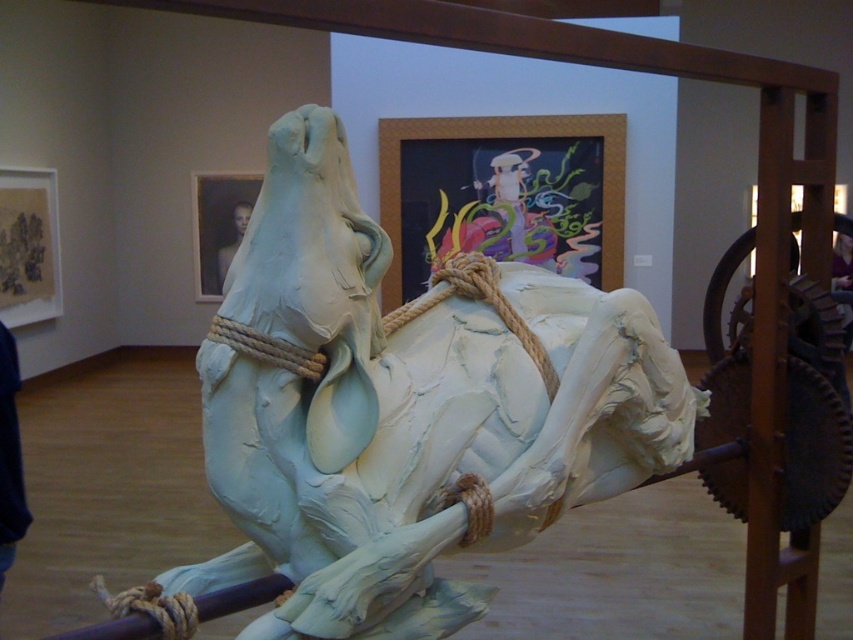
You are an art critic standing in front of the sculpture. You notice the white clay horse at center and the roperoughrope at center. Which object appears nearer to you?

The white clay horse at center is closer to the viewer than the roperoughrope at center, so the white clay horse at center appears nearer.

You are an art critic observing the sculpture of the horse in the gallery. You notice the roperoughrope at center and the smooth skin man at upper center. Which object is positioned higher in the image?

The smooth skin man at upper center is positioned higher than the roperoughrope at center.

You are standing in the gallery and want to take a photo of the sculpture of a horse lying on its side with its legs splayed out and head raised. If you are currently at the point labeled as point [677,456], which is 7.99 feet away from the camera, can you capture the entire sculpture in your shot without moving closer?

The point labeled as point [677,456] is 7.99 feet away from the camera. Since the sculpture is the central focus and the point is at that distance, you can likely capture the entire sculpture in your shot without moving closer, provided your camera has an appropriate lens or zoom capability.